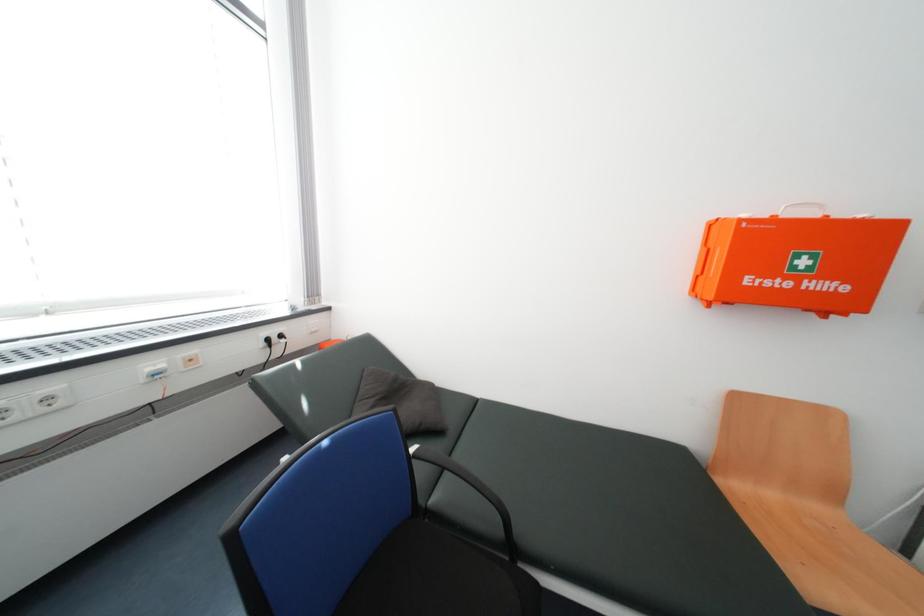
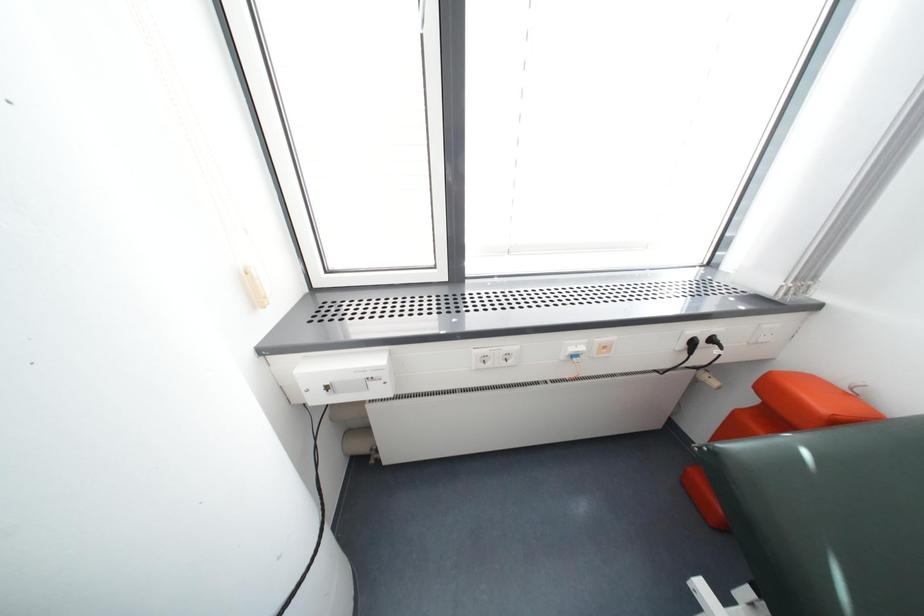
Based on the continuous images, in which direction is the camera rotating?

The camera's rotation is toward left-down.